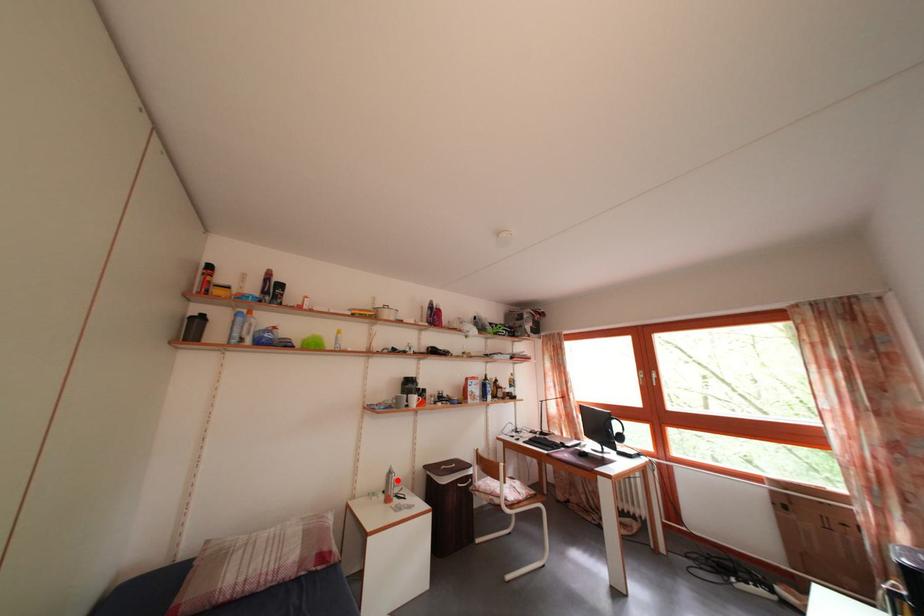
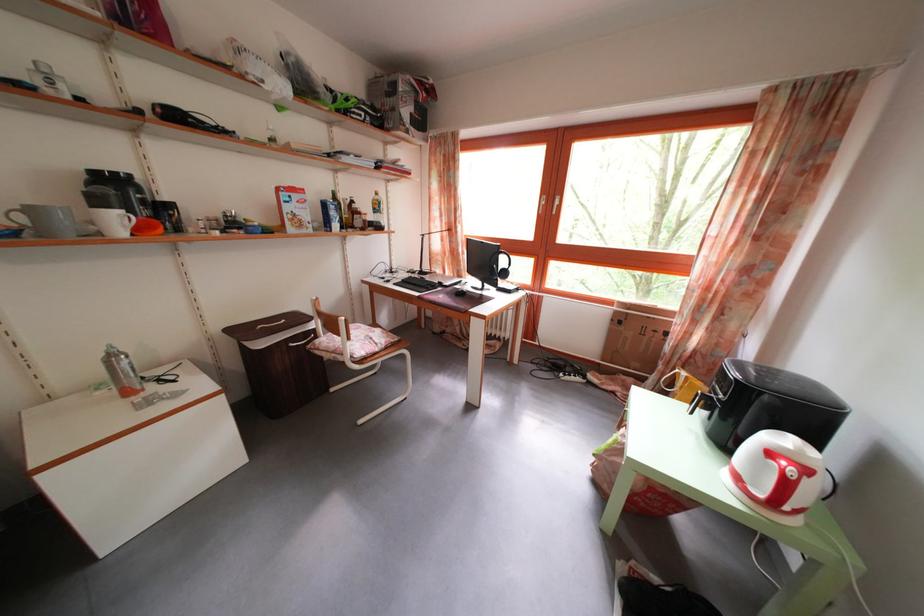
Question: I am providing you with two images of the same scene from different viewpoints. Given a red point in image1, look at the same physical point in image2. Is it:

Choices:
 (A) Closer to the viewpoint
 (B) Farther from the viewpoint

Answer: (A)